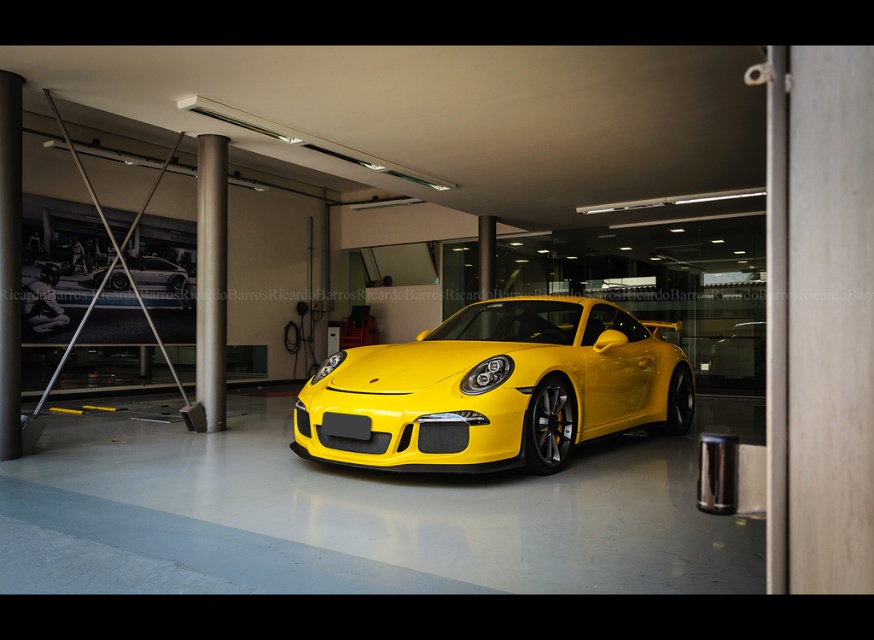
Can you confirm if glossy yellow sports car at center is positioned to the left of satin silver pole at center?

No, glossy yellow sports car at center is not to the left of satin silver pole at center.

Is point (456, 424) less distant than point (214, 145)?

Yes, it is.

Between point (504, 348) and point (222, 326), which one is positioned behind?

Point (222, 326)

The image size is (874, 640). I want to click on glossy yellow sports car at center, so click(x=494, y=388).

Does glossy yellow sports car at center appear over yellow glossy sports car at center?

Actually, glossy yellow sports car at center is below yellow glossy sports car at center.

Describe the element at coordinates (494, 388) in the screenshot. The image size is (874, 640). I see `glossy yellow sports car at center` at that location.

I want to click on glossy yellow sports car at center, so click(494, 388).

Does satin silver pole at center appear over yellow glossy sports car at center?

Actually, satin silver pole at center is below yellow glossy sports car at center.

Which is behind, point (200, 220) or point (108, 266)?

Positioned behind is point (108, 266).

Is point (217, 145) positioned in front of point (162, 282)?

Yes, it is.

Where is `satin silver pole at center`? satin silver pole at center is located at coordinates (212, 278).